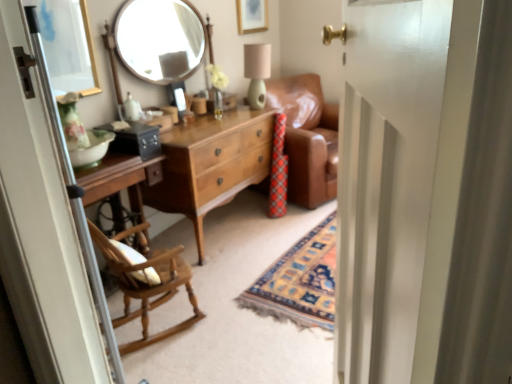
This screenshot has width=512, height=384. Find the location of `vacant region in front of light brown wood dresser at center`. vacant region in front of light brown wood dresser at center is located at coordinates 246,276.